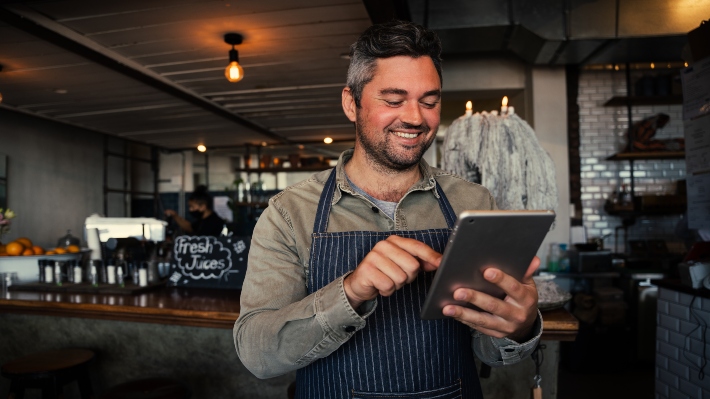
The width and height of the screenshot is (710, 399). I want to click on silver cannisters, so click(50, 273), click(75, 272), click(98, 271), click(116, 272), click(146, 272).